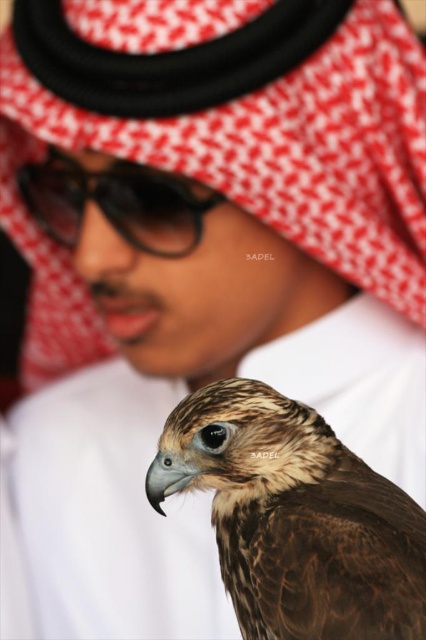
Question: Is brown feathered falcon at lower right to the right of black plastic goggles at upper center from the viewer's perspective?

Choices:
 (A) no
 (B) yes

Answer: (B)

Question: Can you confirm if brown feathered falcon at lower right is positioned below black plastic goggles at upper center?

Choices:
 (A) no
 (B) yes

Answer: (B)

Question: Which point appears farthest from the camera in this image?

Choices:
 (A) (327, 618)
 (B) (48, 179)

Answer: (B)

Question: Is brown feathered falcon at lower right positioned behind black plastic goggles at upper center?

Choices:
 (A) yes
 (B) no

Answer: (B)

Question: Which of the following is the closest to the observer?

Choices:
 (A) black plastic goggles at upper center
 (B) brown feathered falcon at lower right

Answer: (B)